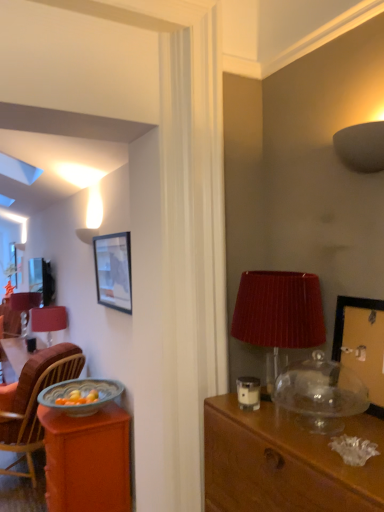
Question: Is matte red lampshade at right, positioned as the second lamp in bottom-to-top order, a part of wooden picture frame at upper right, marked as the second picture frame in a back-to-front arrangement?

Choices:
 (A) no
 (B) yes

Answer: (A)

Question: Is wooden picture frame at upper right, positioned as the 2th picture frame in left-to-right order, closer to camera compared to matte red lampshade at right, which ranks as the 2th lamp in right-to-left order?

Choices:
 (A) no
 (B) yes

Answer: (B)

Question: Is wooden picture frame at upper right, the 1th picture frame from the front, far away from matte red lampshade at right, positioned as the 2th lamp in front-to-back order?

Choices:
 (A) no
 (B) yes

Answer: (A)

Question: Can you confirm if wooden picture frame at upper right, marked as the second picture frame in a back-to-front arrangement, is wider than matte red lampshade at right, positioned as the 2th lamp in front-to-back order?

Choices:
 (A) no
 (B) yes

Answer: (A)

Question: Is wooden picture frame at upper right, positioned as the first picture frame in right-to-left order, smaller than matte red lampshade at right, the second lamp when ordered from left to right?

Choices:
 (A) yes
 (B) no

Answer: (A)

Question: From the image's perspective, would you say wooden picture frame at upper right, positioned as the 2th picture frame in left-to-right order, is positioned over matte red lampshade at right, positioned as the second lamp in back-to-front order?

Choices:
 (A) no
 (B) yes

Answer: (A)

Question: From a real-world perspective, is orange wood desk at left, which is counted as the 2th desk, starting from the top, beneath wooden picture frame at upper right, the 1th picture frame from the front?

Choices:
 (A) no
 (B) yes

Answer: (B)

Question: From a real-world perspective, is orange wood desk at left, which is counted as the 2th desk, starting from the top, positioned over wooden picture frame at upper right, marked as the second picture frame in a back-to-front arrangement, based on gravity?

Choices:
 (A) yes
 (B) no

Answer: (B)

Question: From the image's perspective, is orange wood desk at left, the 1th desk from the back, under wooden picture frame at upper right, positioned as the 2th picture frame in left-to-right order?

Choices:
 (A) no
 (B) yes

Answer: (B)

Question: Can you confirm if orange wood desk at left, the 2th desk in the front-to-back sequence, is thinner than wooden picture frame at upper right, the 1th picture frame from the front?

Choices:
 (A) yes
 (B) no

Answer: (B)

Question: Does orange wood desk at left, marked as the 2th desk in a right-to-left arrangement, have a lesser height compared to wooden picture frame at upper right, marked as the second picture frame in a back-to-front arrangement?

Choices:
 (A) no
 (B) yes

Answer: (A)

Question: Is orange wood desk at left, the 1th desk from the back, taller than wooden picture frame at upper right, the 1th picture frame from the front?

Choices:
 (A) no
 (B) yes

Answer: (B)

Question: From the image's perspective, is wooden picture frame at upper right, positioned as the first picture frame in right-to-left order, over matte red table lamp at left?

Choices:
 (A) yes
 (B) no

Answer: (A)